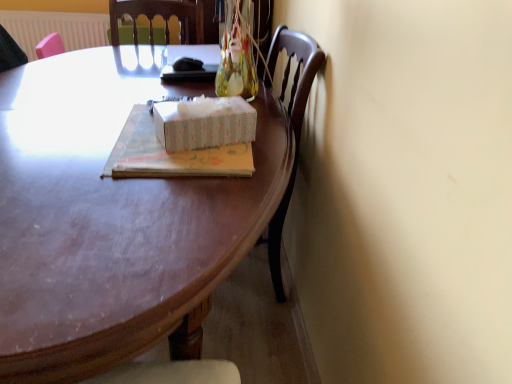
You are a GUI agent. You are given a task and a screenshot of the screen. Output one action in this format:
    pyautogui.click(x=<x>, y=<y>)
    Task: Click on the vacant area on top of shiny brown desk at center (from a real-world perspective)
    
    Given the screenshot: What is the action you would take?
    pyautogui.click(x=97, y=148)